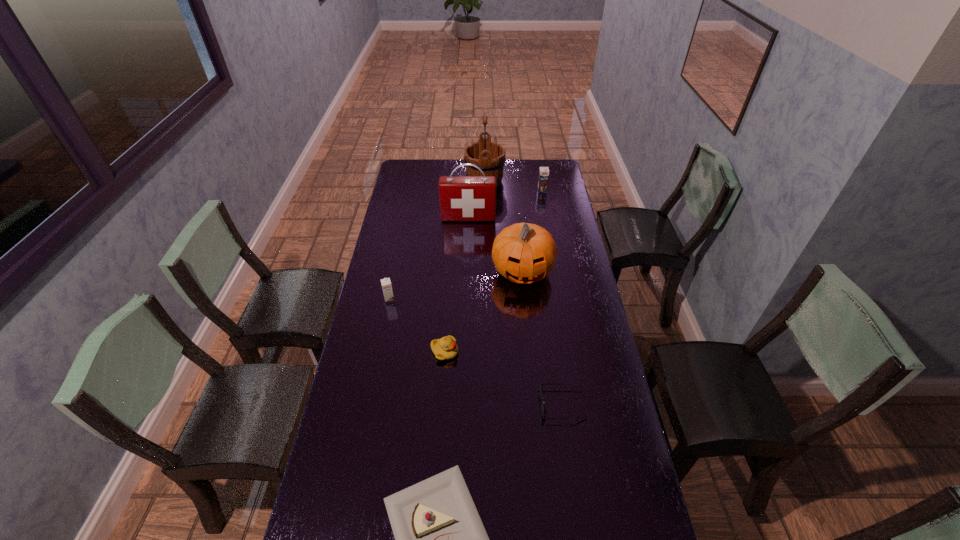
Find the location of a particular element. The height and width of the screenshot is (540, 960). object at the far edge is located at coordinates (489, 156).

This screenshot has height=540, width=960. I want to click on object that is at the left edge, so click(386, 283).

Find the location of a particular element. pumpkin present at the right edge is located at coordinates (524, 253).

Find the location of a particular element. This screenshot has height=540, width=960. chocolate milk situated at the right edge is located at coordinates (543, 171).

What are the coordinates of `sunglasses positioned at the right edge` in the screenshot? It's located at (544, 411).

Identify the location of free spot at the left edge of the desktop. (384, 329).

Image resolution: width=960 pixels, height=540 pixels. I want to click on free location at the right edge of the desktop, so click(611, 501).

In the image, there is a desktop. At what (x,y) coordinates should I click in order to perform the action: click on free space at the far right corner. Please return your answer as a coordinate pair (x, y). The height and width of the screenshot is (540, 960). Looking at the image, I should click on (537, 163).

Identify the location of empty location between the first-aid kit and the farther chocolate milk. (505, 204).

Image resolution: width=960 pixels, height=540 pixels. I want to click on vacant space that is in between the sunglasses and the fourth nearest object, so click(x=476, y=352).